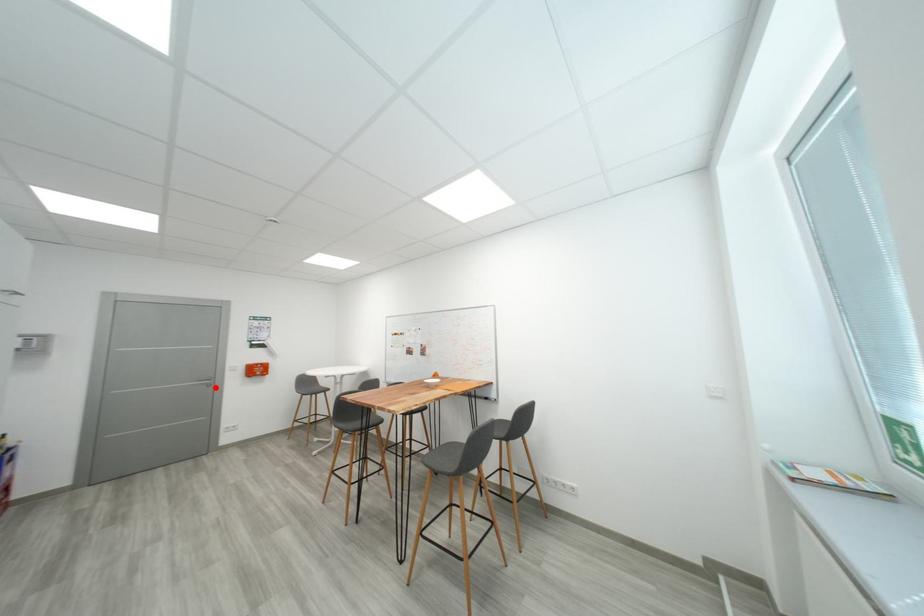
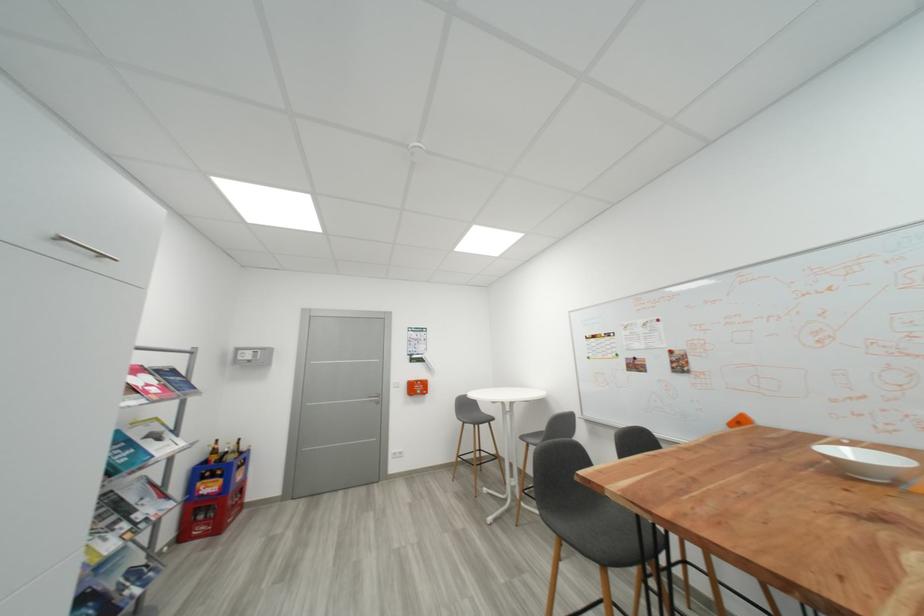
Find the pixel in the second image that matches the highlighted location in the first image.

(383, 405)